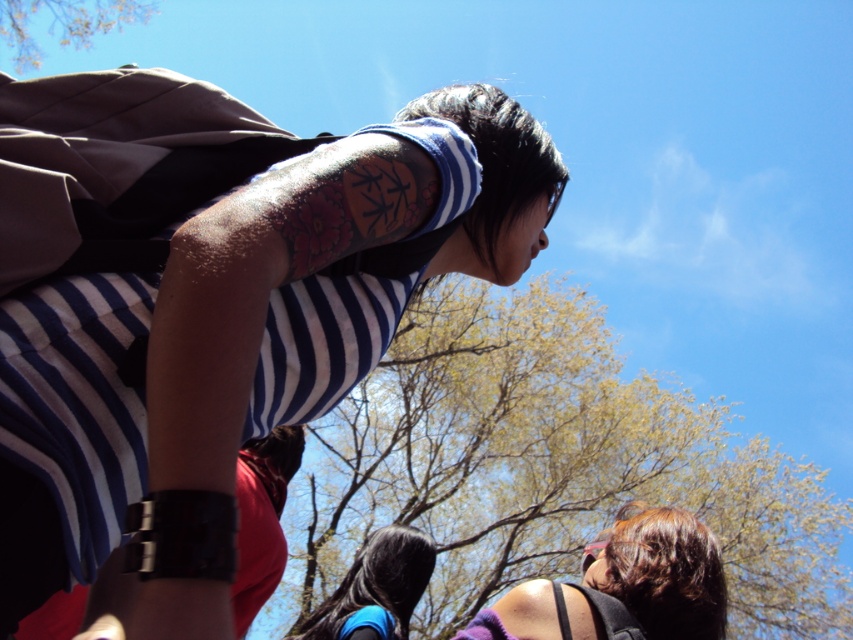
Question: Estimate the real-world distances between objects in this image. Which object is farther from the green leafy tree at upper center?

Choices:
 (A) green leafy tree at upper left
 (B) matte striped shirt at center
 (C) smooth black hair at center
 (D) matte purple tank top at lower right

Answer: (D)

Question: Is green leafy tree at upper center in front of matte purple tank top at lower right?

Choices:
 (A) yes
 (B) no

Answer: (A)

Question: Which of the following is the closest to the observer?

Choices:
 (A) [376, 561]
 (B) [665, 586]

Answer: (B)

Question: Is matte striped shirt at center to the left of green leafy tree at upper left from the viewer's perspective?

Choices:
 (A) no
 (B) yes

Answer: (A)

Question: Among these points, which one is farthest from the camera?

Choices:
 (A) (73, 44)
 (B) (520, 198)
 (C) (498, 637)

Answer: (A)

Question: Does matte purple tank top at lower right have a lesser width compared to green leafy tree at upper left?

Choices:
 (A) yes
 (B) no

Answer: (A)